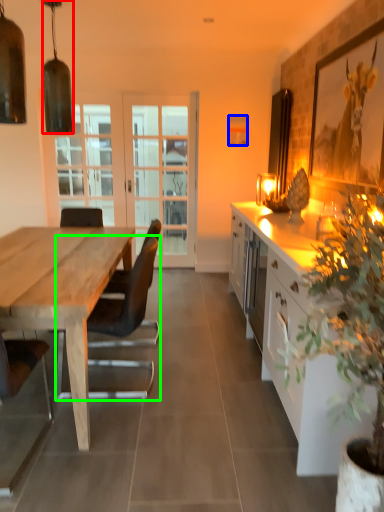
Question: Considering the real-world distances, which object is farthest from lamp (highlighted by a red box)? picture frame (highlighted by a blue box) or chair (highlighted by a green box)?

Choices:
 (A) picture frame
 (B) chair

Answer: (B)